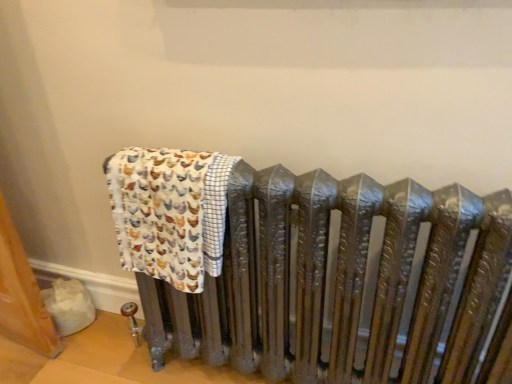
Locate an element on the screen. vacant point above patterned fabric towel at center (from a real-world perspective) is located at coordinates (170, 158).